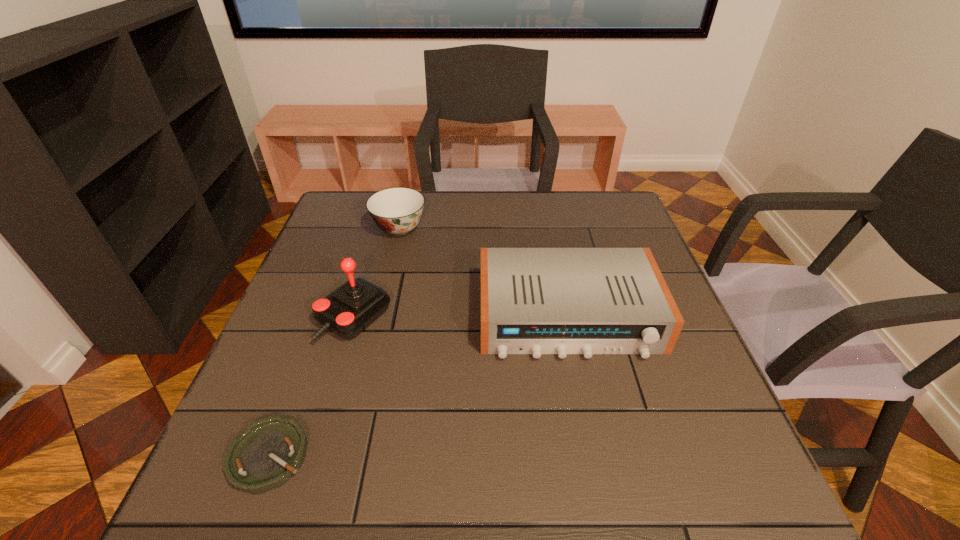
I want to click on joystick, so click(x=351, y=308).

Locate an element on the screen. The width and height of the screenshot is (960, 540). radio receiver is located at coordinates (536, 301).

Image resolution: width=960 pixels, height=540 pixels. Identify the location of the farthest object. (397, 211).

Where is `the nearest object`? The image size is (960, 540). the nearest object is located at coordinates (270, 451).

You are a GUI agent. You are given a task and a screenshot of the screen. Output one action in this format:
    pyautogui.click(x=<x>, y=<y>)
    Task: Click on the ashtray
    This screenshot has height=540, width=960.
    Given the screenshot: What is the action you would take?
    pyautogui.click(x=270, y=451)

In order to click on free spot located 0.080m on the right of the tallest object in this screenshot , I will do `click(424, 318)`.

Image resolution: width=960 pixels, height=540 pixels. In order to click on vacant region located 0.240m on the control panel of the rightmost object in this screenshot , I will do `click(601, 475)`.

What are the coordinates of `free space located on the front of the farthest object` in the screenshot? It's located at (380, 308).

Locate an element on the screen. Image resolution: width=960 pixels, height=540 pixels. vacant space located 0.290m on the right of the nearest object is located at coordinates (471, 456).

The image size is (960, 540). I want to click on object located in the far edge section of the desktop, so click(397, 211).